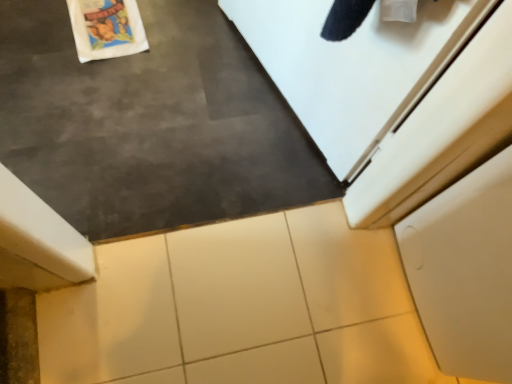
Question: From the image's perspective, is white tile at center over white matte cabinet at lower right?

Choices:
 (A) yes
 (B) no

Answer: (B)

Question: Is white tile at center further to the viewer compared to white matte cabinet at lower right?

Choices:
 (A) yes
 (B) no

Answer: (A)

Question: Is white tile at center positioned before white matte cabinet at lower right?

Choices:
 (A) no
 (B) yes

Answer: (A)

Question: Is white tile at center turned away from white matte cabinet at lower right?

Choices:
 (A) no
 (B) yes

Answer: (A)

Question: From the image's perspective, is white tile at center under white matte cabinet at lower right?

Choices:
 (A) yes
 (B) no

Answer: (A)

Question: From the image's perspective, relative to slate at center, is white matte cabinet at lower right above or below?

Choices:
 (A) below
 (B) above

Answer: (A)

Question: Is white matte cabinet at lower right in front of or behind slate at center in the image?

Choices:
 (A) behind
 (B) front

Answer: (A)

Question: Considering the positions of white matte cabinet at lower right and slate at center in the image, is white matte cabinet at lower right taller or shorter than slate at center?

Choices:
 (A) short
 (B) tall

Answer: (A)

Question: Considering the positions of point (421, 241) and point (106, 225), is point (421, 241) closer or farther from the camera than point (106, 225)?

Choices:
 (A) farther
 (B) closer

Answer: (B)

Question: From a real-world perspective, is white glossy tile at center positioned above or below white matte cabinet at lower right?

Choices:
 (A) below
 (B) above

Answer: (A)

Question: Based on their sizes in the image, would you say white glossy tile at center is bigger or smaller than white matte cabinet at lower right?

Choices:
 (A) small
 (B) big

Answer: (A)

Question: Is white glossy tile at center in front of or behind white matte cabinet at lower right in the image?

Choices:
 (A) behind
 (B) front

Answer: (A)

Question: From the image's perspective, is white glossy tile at center located above or below white matte cabinet at lower right?

Choices:
 (A) above
 (B) below

Answer: (B)

Question: Is white matte cabinet at lower right inside or outside of white tile at center?

Choices:
 (A) inside
 (B) outside

Answer: (B)

Question: In terms of height, does white matte cabinet at lower right look taller or shorter compared to white tile at center?

Choices:
 (A) short
 (B) tall

Answer: (B)